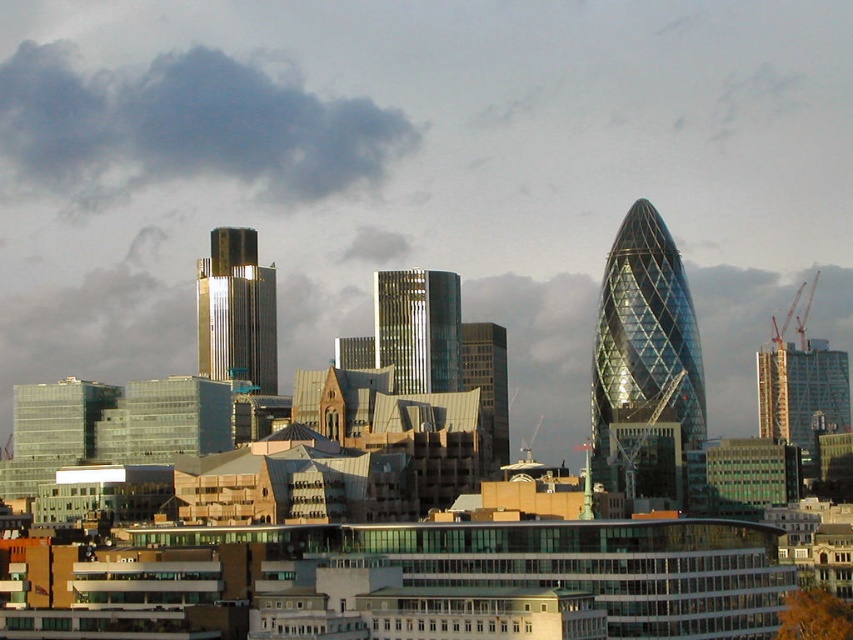
Is dark gray cloud at upper left positioned behind gold reflective glass skyscraper at center?

Yes.

Can you confirm if dark gray cloud at upper left is positioned above gold reflective glass skyscraper at center?

Indeed, dark gray cloud at upper left is positioned over gold reflective glass skyscraper at center.

This screenshot has height=640, width=853. I want to click on dark gray cloud at upper left, so click(x=183, y=129).

Is gold reflective glass skyscraper at center further to the viewer compared to shiny metallic skyscraper at center?

Yes, it is.

The width and height of the screenshot is (853, 640). What do you see at coordinates (236, 310) in the screenshot?
I see `gold reflective glass skyscraper at center` at bounding box center [236, 310].

Identify the location of gold reflective glass skyscraper at center. The image size is (853, 640). (236, 310).

Who is higher up, dark gray cloud at upper left or glassy reflective skyscraper at center?

dark gray cloud at upper left is above.

Identify the location of dark gray cloud at upper left. The image size is (853, 640). (183, 129).

Does point (184, 52) come behind point (476, 380)?

Yes, it is behind point (476, 380).

Find the location of a particular element. dark gray cloud at upper left is located at coordinates (183, 129).